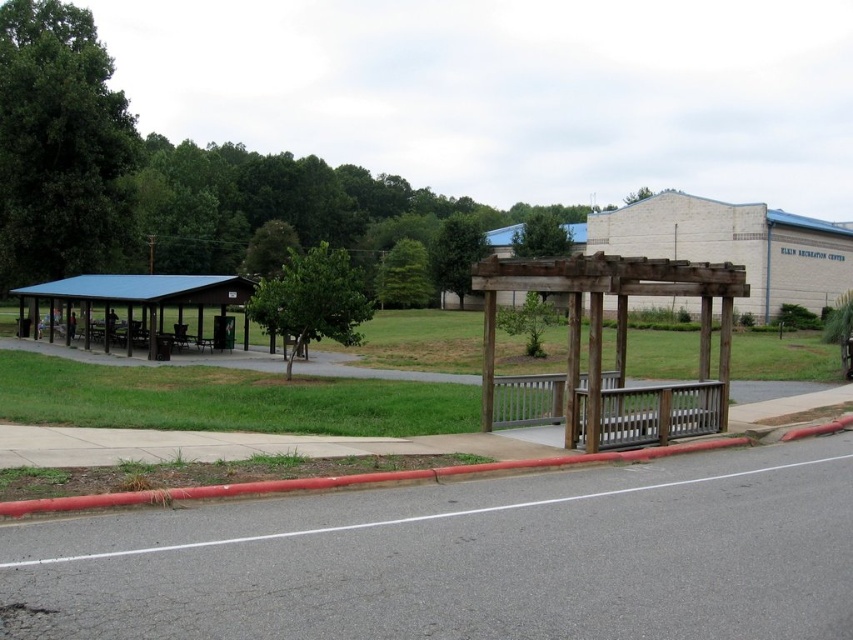
Consider the image. You are a visitor at the park and want to take a photo of both the wooden pergola at upper right and the red rubber curb at lower left in the same frame. Based on their positions, which one should you position closer to the top of your camera viewfinder?

The wooden pergola at upper right should be positioned closer to the top of the camera viewfinder because it is above the red rubber curb at lower left.

You are designing a new pathway for the park and need to know the relative widths of the wooden pergola at upper right and the red rubber curb at lower left. Which one is wider?

The wooden pergola at upper right is wider than the red rubber curb at lower left according to the description.